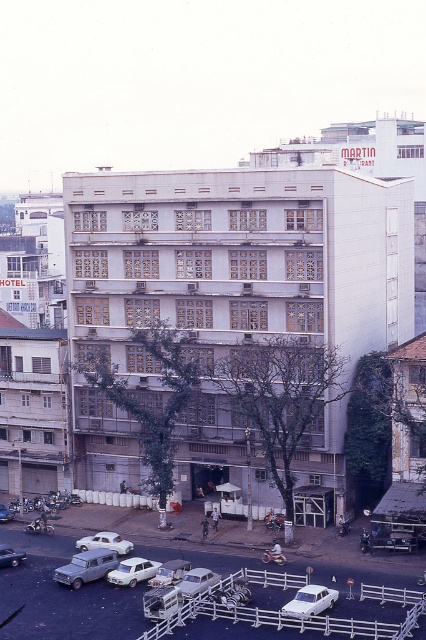
Question: Which object is the farthest from the white matte sedan at lower left?

Choices:
 (A) silver metallic sedan at lower left
 (B) silver metallic sedan at center
 (C) matte silver sedan at lower left

Answer: (B)

Question: Which point is closer to the camera?

Choices:
 (A) white matte car at center
 (B) white concrete building at center

Answer: (A)

Question: Does white concrete building at center have a greater width compared to white matte parking lot at lower center?

Choices:
 (A) yes
 (B) no

Answer: (A)

Question: From the image, what is the correct spatial relationship of silver metallic sedan at center in relation to white matte car at lower left?

Choices:
 (A) above
 (B) below

Answer: (B)

Question: Is white matte car at center below matte silver sedan at lower left?

Choices:
 (A) no
 (B) yes

Answer: (A)

Question: Which of the following is the farthest from the observer?

Choices:
 (A) (103, 561)
 (B) (2, 506)
 (C) (86, 538)
 (D) (101, 579)

Answer: (B)